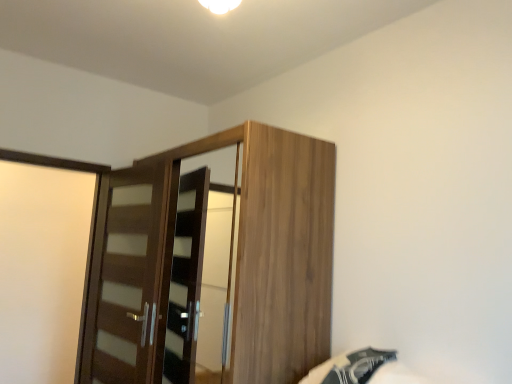
Question: Considering the positions of brown wood door at left and wooden wardrobe at center in the image, is brown wood door at left wider or thinner than wooden wardrobe at center?

Choices:
 (A) wide
 (B) thin

Answer: (B)

Question: Would you say brown wood door at left is to the left or to the right of wooden wardrobe at center in the picture?

Choices:
 (A) left
 (B) right

Answer: (A)

Question: Which object is positioned closest to the brown wood door at left?

Choices:
 (A) wooden wardrobe at center
 (B) black fabric bed at lower right

Answer: (A)

Question: Estimate the real-world distances between objects in this image. Which object is farther from the brown wood door at left?

Choices:
 (A) wooden wardrobe at center
 (B) black fabric bed at lower right

Answer: (B)